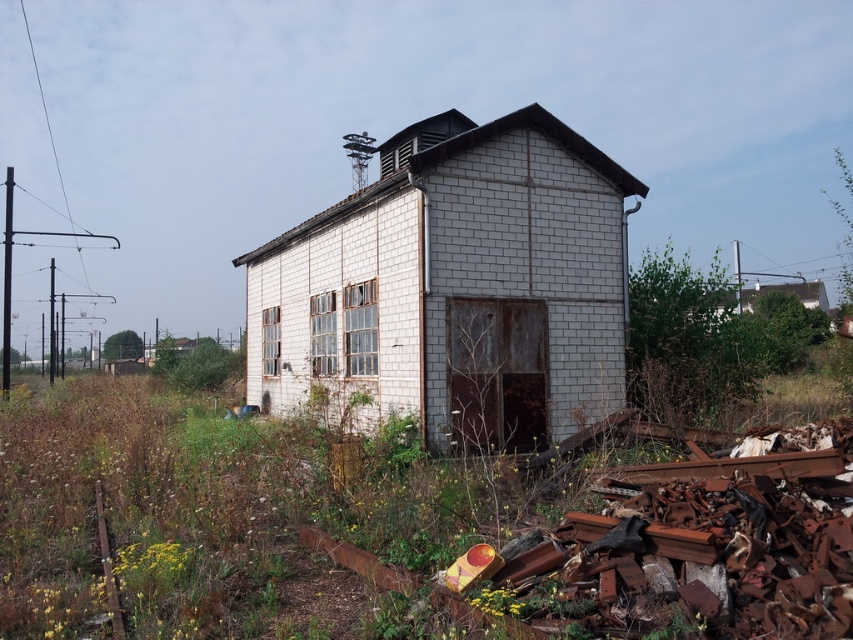
You are a surveyor using a GPS device. You need to locate the white brick hut at upper right. What are its coordinates?

The white brick hut at upper right is located at coordinates point (778, 291).

You are a delivery driver trying to navigate through the area shown in the image. You need to reach the white brick hut at upper right but there is a rusty metal train track at lower left blocking your path. Can you go around the track to reach the hut?

The white brick hut at upper right is to the right of the rusty metal train track at lower left, so you can go around the track on the right side to reach the hut.